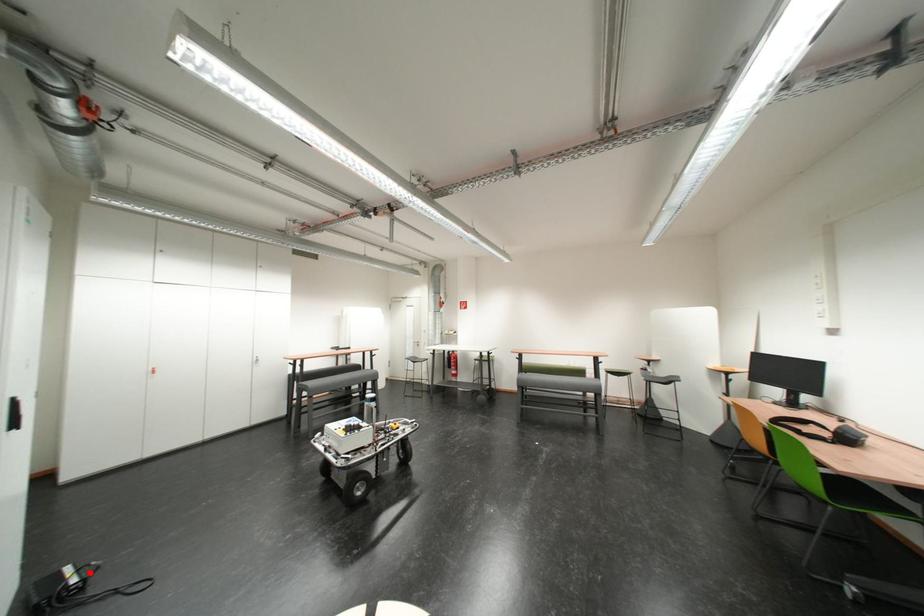
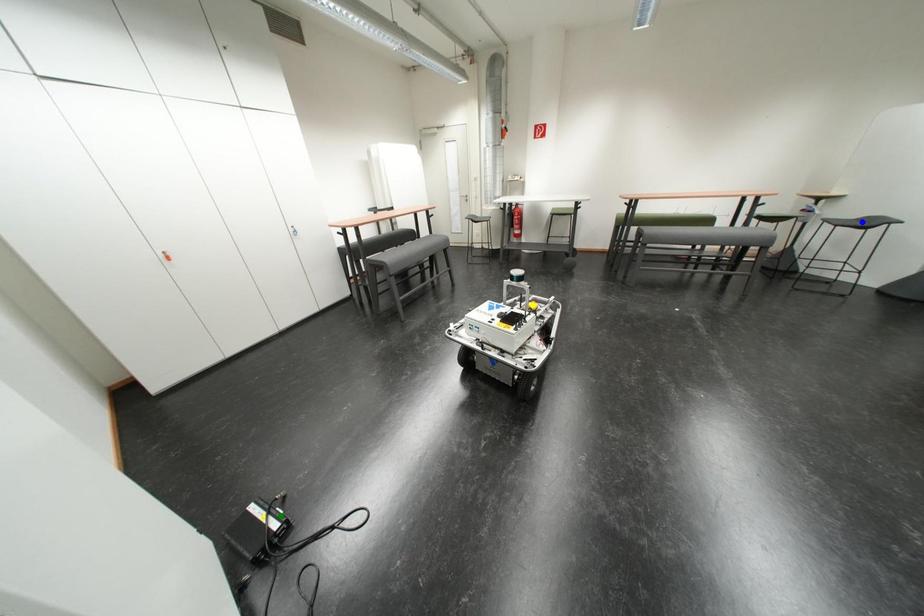
Question: I am providing you with two images of the same scene from different viewpoints. A red point is marked on the first image. You are given multiple points on the second image. Which point in image 2 represents the same 3d spot as the red point in image 1?

Choices:
 (A) yellow point
 (B) green point
 (C) blue point

Answer: (B)